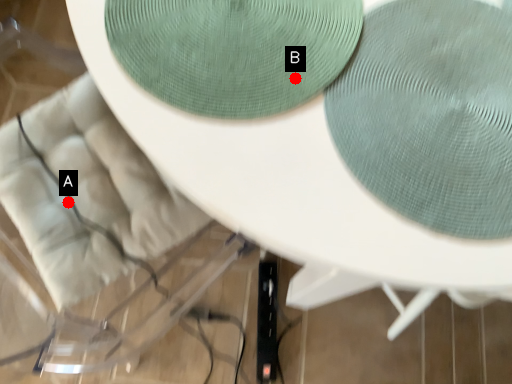
Question: Two points are circled on the image, labeled by A and B beside each circle. Which point appears farthest from the camera in this image?

Choices:
 (A) A is further
 (B) B is further

Answer: (A)